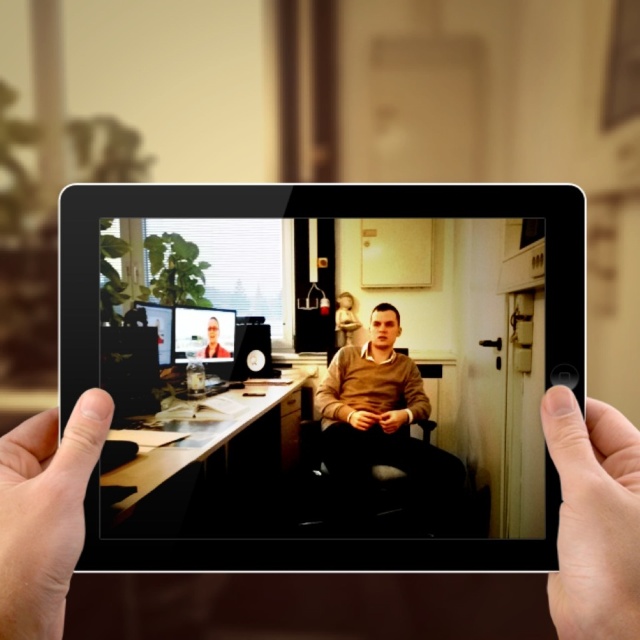
In the scene shown: You are trying to decide which device to use for a presentation. The black glossy tablet computer at center and the matte black monitor at upper left are both available. Which device has a bigger screen?

The black glossy tablet computer at center is larger in size than the matte black monitor at upper left, so the black glossy tablet computer at center has a bigger screen.

You are a delivery person who needs to place a black glossy tablet computer at center and a smooth skin hand at right into two separate boxes. The box for the tablet is height 10 cm and the box for the hand is height 8 cm. Which item will not fit into its designated box?

The black glossy tablet computer at center has a greater height compared to the smooth skin hand at right. Since the tablet box is 10 cm and the hand box is 8 cm, the tablet might not fit into its box if its height exceeds 10 cm, while the hand should fit into the 8 cm box if its height is less than or equal to 8 cm.